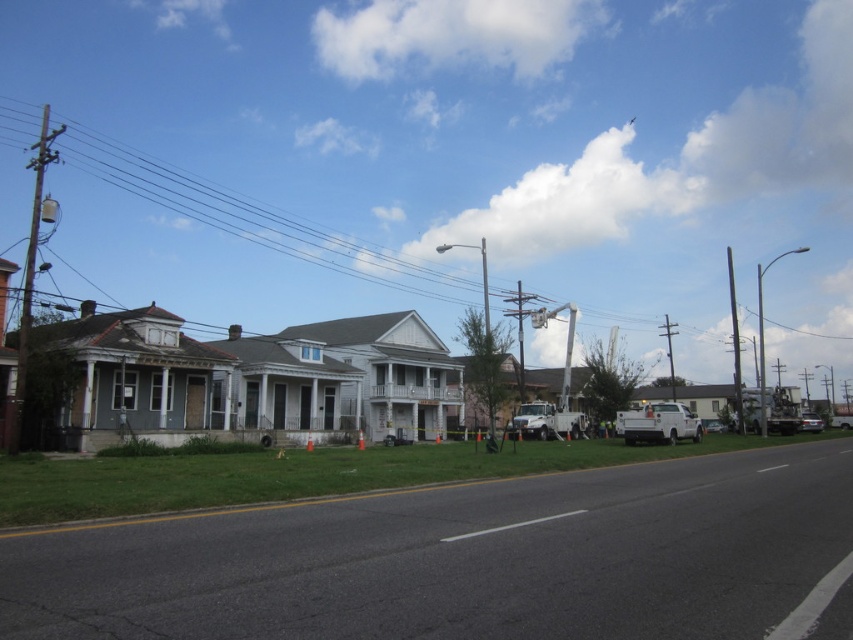
Is white matte truck at right thinner than silver metallic sedan at right?

Incorrect, white matte truck at right's width is not less than silver metallic sedan at right's.

Between white matte truck at right and silver metallic sedan at right, which one appears on the right side from the viewer's perspective?

silver metallic sedan at right

Where is `white matte truck at right`? The image size is (853, 640). white matte truck at right is located at coordinates (659, 422).